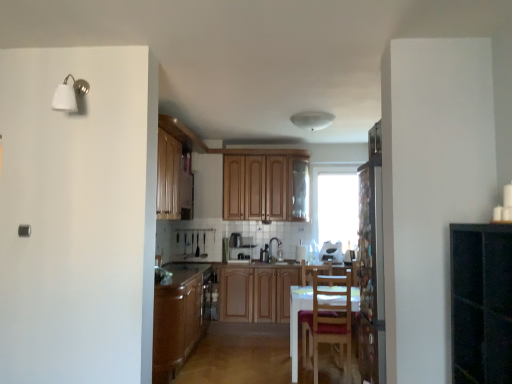
Question: Is brown wood cabinet at center, placed as the first cabinetry when sorted from bottom to top, turned away from white glossy toaster at center, which is counted as the 1th appliance, starting from the right?

Choices:
 (A) no
 (B) yes

Answer: (A)

Question: Is the surface of brown wood cabinet at center, the 1th cabinetry from the front, in direct contact with white glossy toaster at center, which is counted as the 1th appliance, starting from the right?

Choices:
 (A) no
 (B) yes

Answer: (A)

Question: From the image's perspective, does brown wood cabinet at center, placed as the first cabinetry when sorted from bottom to top, appear lower than white glossy toaster at center, placed as the third appliance when sorted from left to right?

Choices:
 (A) no
 (B) yes

Answer: (B)

Question: From the image's perspective, is brown wood cabinet at center, the 1th cabinetry from the front, over white glossy toaster at center, placed as the third appliance when sorted from left to right?

Choices:
 (A) no
 (B) yes

Answer: (A)

Question: Is the depth of brown wood cabinet at center, which is the 2th cabinetry in top-to-bottom order, less than that of white glossy toaster at center, which is counted as the 1th appliance, starting from the right?

Choices:
 (A) yes
 (B) no

Answer: (A)

Question: Is brown wood cabinet at center, arranged as the second cabinetry when viewed from the back, to the left of white glossy toaster at center, placed as the third appliance when sorted from left to right, from the viewer's perspective?

Choices:
 (A) yes
 (B) no

Answer: (A)

Question: Can you confirm if white glossy toaster at center, which is counted as the 1th appliance, starting from the right, is thinner than matte brown countertop at lower center?

Choices:
 (A) no
 (B) yes

Answer: (B)

Question: Does white glossy toaster at center, placed as the third appliance when sorted from left to right, have a larger size compared to matte brown countertop at lower center?

Choices:
 (A) yes
 (B) no

Answer: (B)

Question: Does white glossy toaster at center, which is counted as the 1th appliance, starting from the right, come in front of matte brown countertop at lower center?

Choices:
 (A) yes
 (B) no

Answer: (B)

Question: Is white glossy toaster at center, which is counted as the 1th appliance, starting from the right, to the right of matte brown countertop at lower center from the viewer's perspective?

Choices:
 (A) no
 (B) yes

Answer: (B)

Question: Is white glossy toaster at center, placed as the third appliance when sorted from left to right, with matte brown countertop at lower center?

Choices:
 (A) yes
 (B) no

Answer: (B)

Question: Does white glossy toaster at center, placed as the third appliance when sorted from left to right, lie behind matte brown countertop at lower center?

Choices:
 (A) yes
 (B) no

Answer: (A)

Question: Is wooden cabinet at center, arranged as the second appliance when viewed from the left, facing towards wooden chair at center?

Choices:
 (A) yes
 (B) no

Answer: (B)